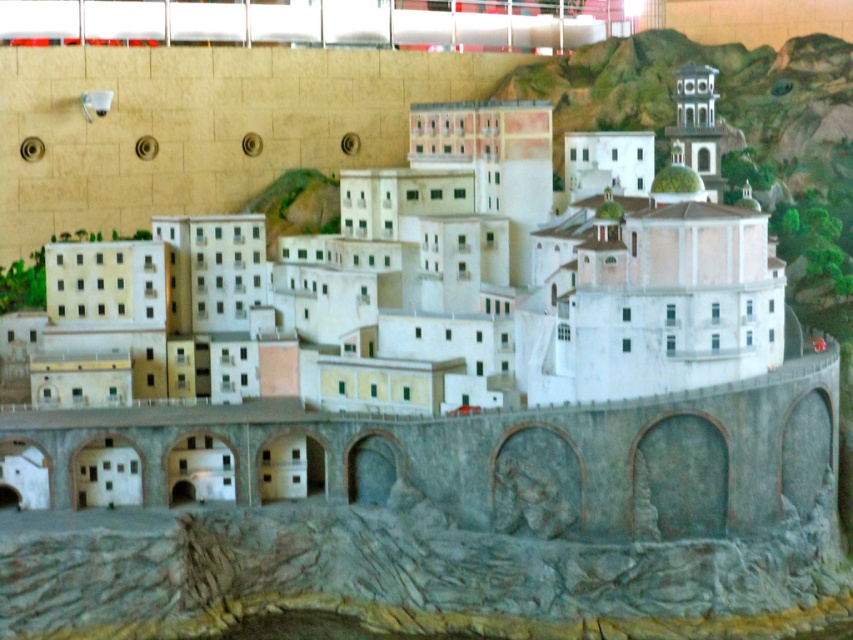
Question: Among these objects, which one is nearest to the camera?

Choices:
 (A) white matte building at center
 (B) stone arch bridge at center

Answer: (B)

Question: Observing the image, what is the correct spatial positioning of white matte building at center in reference to stone arch bridge at center?

Choices:
 (A) left
 (B) right

Answer: (A)

Question: Is white matte building at center positioned behind stone arch bridge at center?

Choices:
 (A) no
 (B) yes

Answer: (B)

Question: Can you confirm if white matte building at center is smaller than stone arch bridge at center?

Choices:
 (A) yes
 (B) no

Answer: (B)

Question: Which point appears farthest from the camera in this image?

Choices:
 (A) (102, 392)
 (B) (677, 445)

Answer: (A)